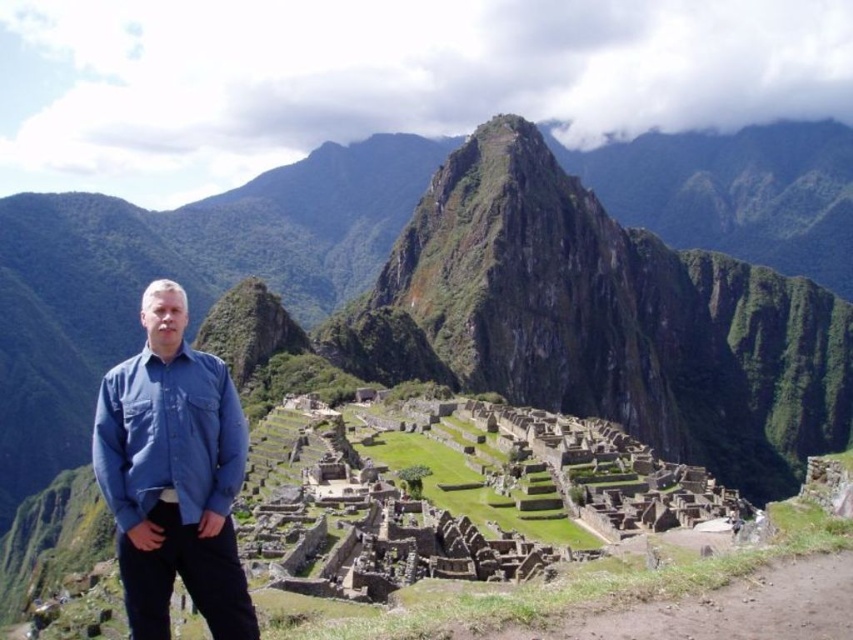
Question: Is green grassy mountain at center below blue cotton shirt at left?

Choices:
 (A) yes
 (B) no

Answer: (B)

Question: Where is green grassy mountain at center located in relation to blue cotton shirt at left in the image?

Choices:
 (A) right
 (B) left

Answer: (A)

Question: From the image, what is the correct spatial relationship of green grassy mountain at center in relation to blue cotton shirt at left?

Choices:
 (A) below
 (B) above

Answer: (B)

Question: Which of the following is the closest to the observer?

Choices:
 (A) (283, 188)
 (B) (154, 554)

Answer: (B)

Question: Which point appears closest to the camera in this image?

Choices:
 (A) (160, 252)
 (B) (144, 552)

Answer: (B)

Question: Which object appears farthest from the camera in this image?

Choices:
 (A) blue cotton shirt at left
 (B) green grassy mountain at center

Answer: (B)